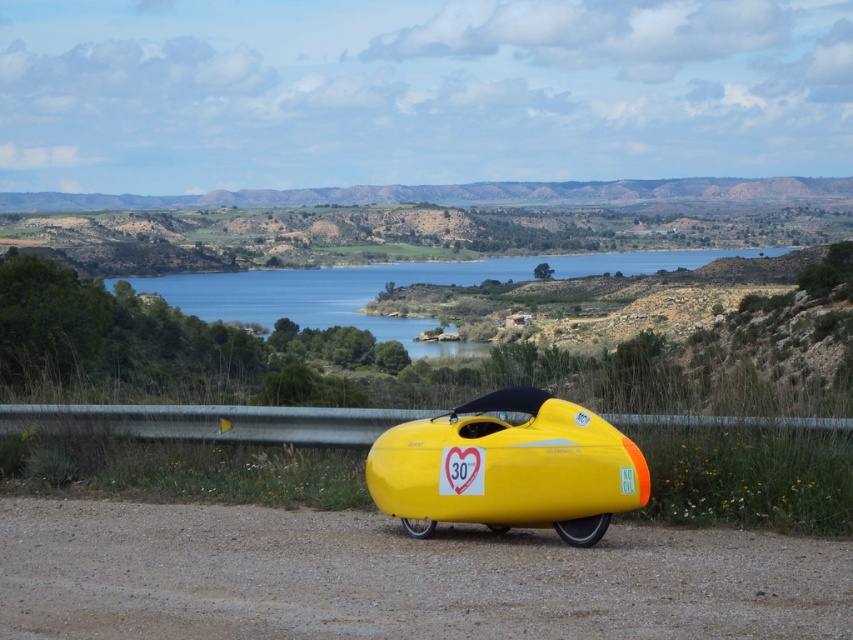
You are a delivery person who needs to cross the blue water at center to deliver a package to the yellow matte bicycle at lower center. The boat you have can carry a maximum weight of 40 kilograms. The distance between the two points is 34.41 meters. If your total weight with the package is 75 kilograms, can you safely use the boat to reach the bicycle?

The distance between the yellow matte bicycle at lower center and the blue water at center is 34.41 meters. However, the boat can only carry 40 kilograms, but your total weight with the package is 75 kilograms, which exceeds the boat capacity. Therefore, you cannot safely use the boat to reach the bicycle.

You are standing at the origin point of the coordinate system. You want to move towards the yellow matte bicycle at lower center. What are the coordinates you need to move to reach it?

The yellow matte bicycle at lower center is located at coordinates point (x=397, y=577), so you need to move to those coordinates to reach it.